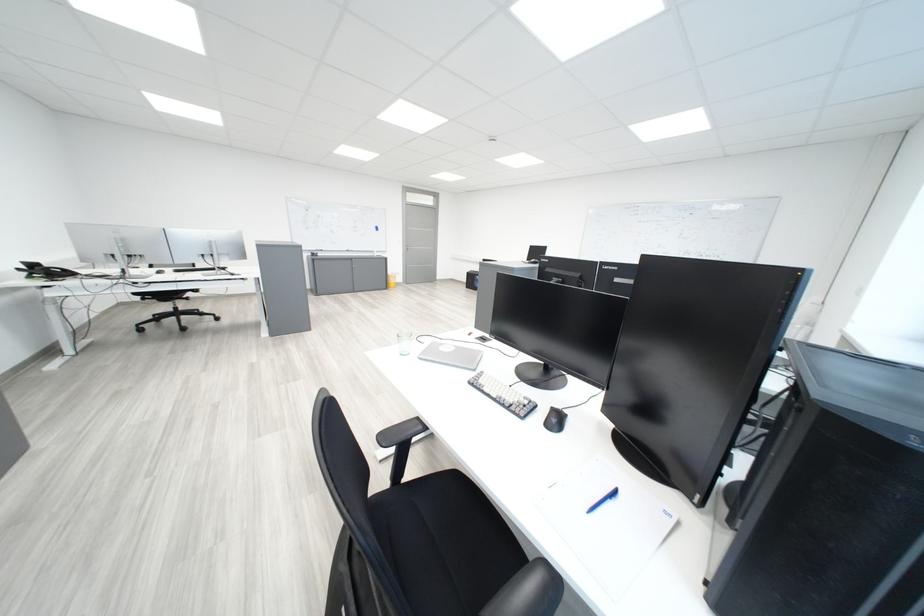
At what (x,y) coordinates should I click in order to perform the action: click on grey door handle. Please return your answer as a coordinate pair (x, y). Image resolution: width=924 pixels, height=616 pixels. Looking at the image, I should click on (419, 256).